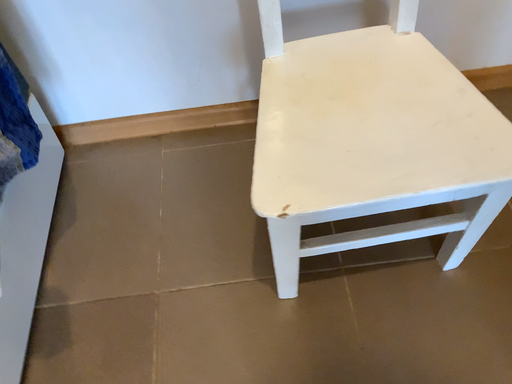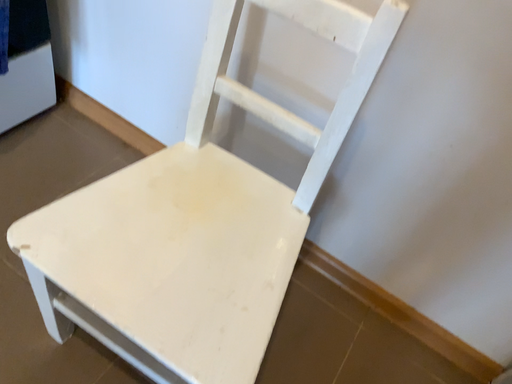
Question: How did the camera likely rotate when shooting the video?

Choices:
 (A) rotated right
 (B) rotated left

Answer: (B)